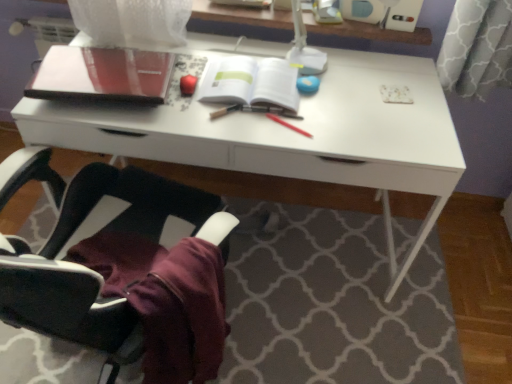
The width and height of the screenshot is (512, 384). I want to click on vacant space that's between wooden pencil at center, the 2th stationery positioned from the left, and glossy red apple at upper center, marked as the third stationery in a right-to-left arrangement, so click(210, 108).